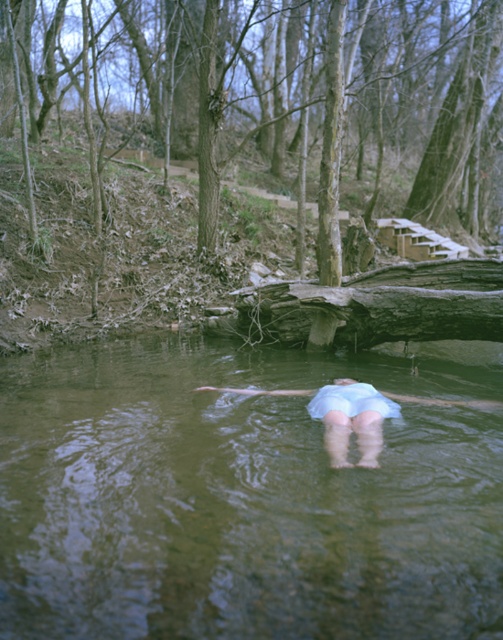
From the picture: Is green murky water at center thinner than light blue fabric at center?

In fact, green murky water at center might be wider than light blue fabric at center.

Who is shorter, green murky water at center or light blue fabric at center?

With less height is green murky water at center.

Locate an element on the screen. The width and height of the screenshot is (503, 640). green murky water at center is located at coordinates (240, 499).